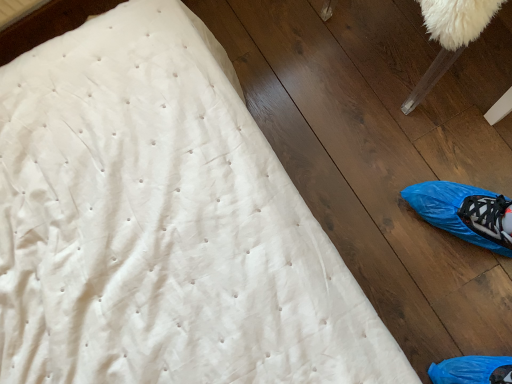
The width and height of the screenshot is (512, 384). Find the location of `vacant area that is in front of white fluffy bean bag chair at upper right`. vacant area that is in front of white fluffy bean bag chair at upper right is located at coordinates tap(452, 158).